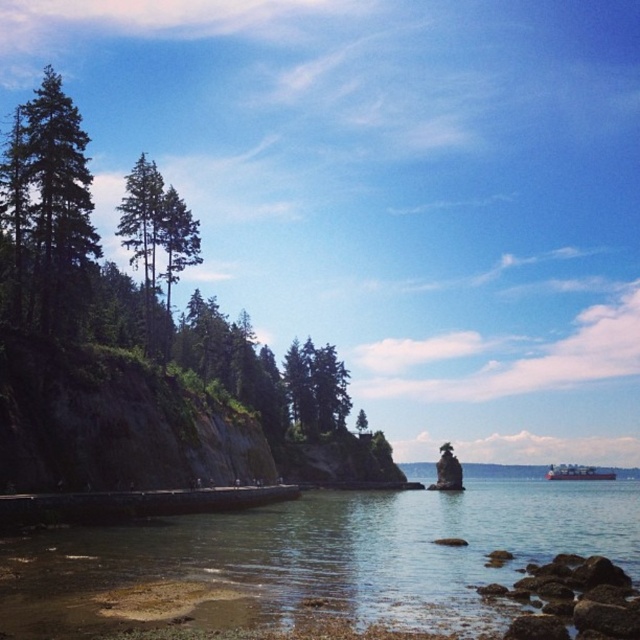
Can you confirm if clear water at center is bigger than brown rough rocks at lower right?

Yes.

Is point (468, 576) closer to camera compared to point (557, 595)?

No, it is behind (557, 595).

Find the location of `clear water at center`. clear water at center is located at coordinates (328, 554).

This screenshot has height=640, width=640. Identify the location of clear water at center. (328, 554).

Does green matte tree at left appear on the right side of green matte tree at center?

No, green matte tree at left is not to the right of green matte tree at center.

Can you confirm if green matte tree at left is wider than green matte tree at center?

Yes, green matte tree at left is wider than green matte tree at center.

Describe the element at coordinates (51, 205) in the screenshot. I see `green matte tree at left` at that location.

At what (x,y) coordinates should I click in order to perform the action: click on green matte tree at left. Please return your answer as a coordinate pair (x, y). This screenshot has height=640, width=640. Looking at the image, I should click on (51, 205).

Who is higher up, clear water at center or green matte tree at center?

green matte tree at center is higher up.

Based on the photo, is clear water at center behind green matte tree at center?

No, clear water at center is closer to the viewer.

Find the location of a particular element. The width and height of the screenshot is (640, 640). clear water at center is located at coordinates (328, 554).